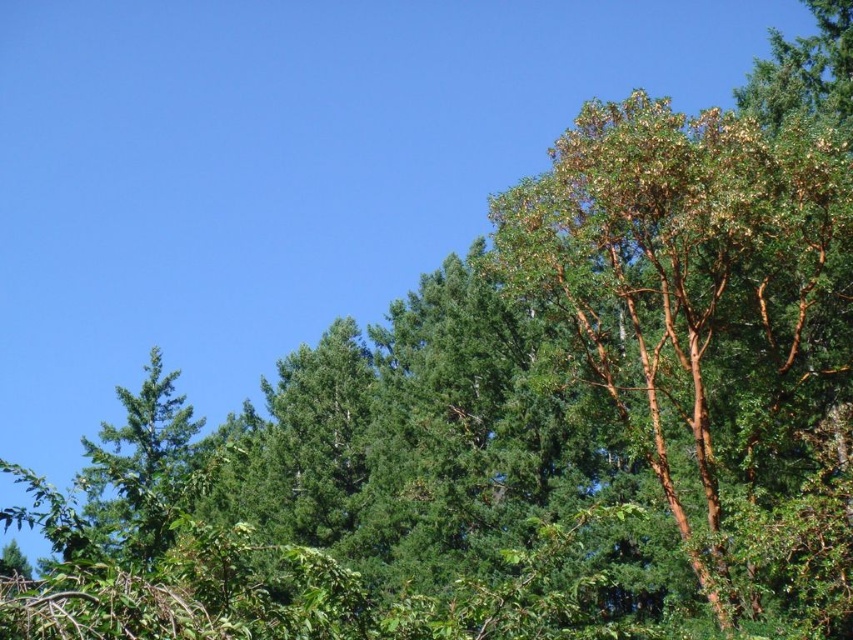
At what (x,y) coordinates should I click in order to perform the action: click on brown/scaly bark tree at right. Please return your answer as a coordinate pair (x, y). Looking at the image, I should click on (689, 291).

Consider the image. Can you confirm if brown/scaly bark tree at right is thinner than green matte tree at left?

Indeed, brown/scaly bark tree at right has a lesser width compared to green matte tree at left.

Is point (587, 266) closer to camera compared to point (96, 477)?

That is True.

I want to click on brown/scaly bark tree at right, so click(689, 291).